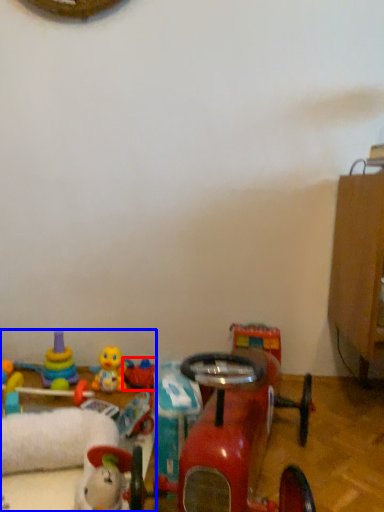
Question: Which object appears farthest to the camera in this image, toy (highlighted by a red box) or toy (highlighted by a blue box)?

Choices:
 (A) toy
 (B) toy

Answer: (A)